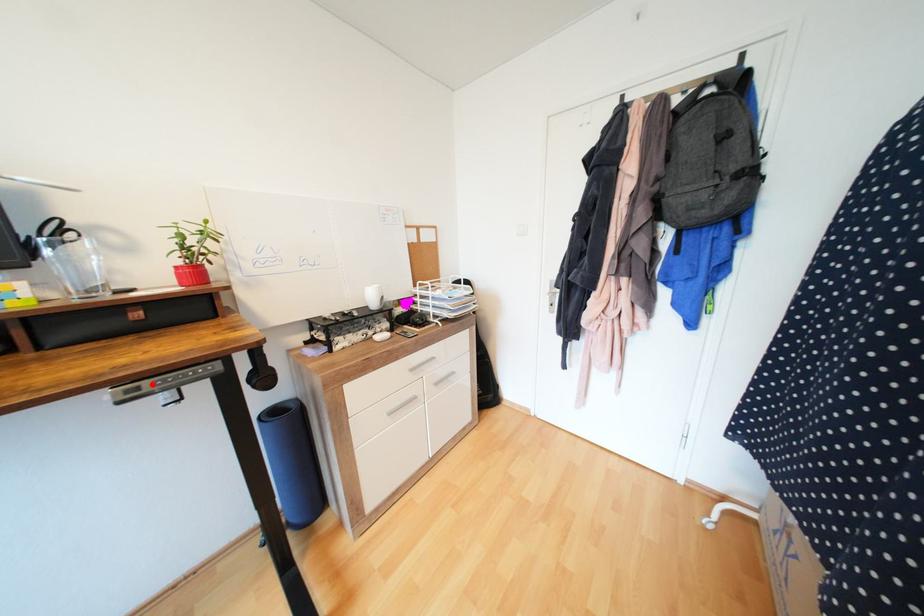
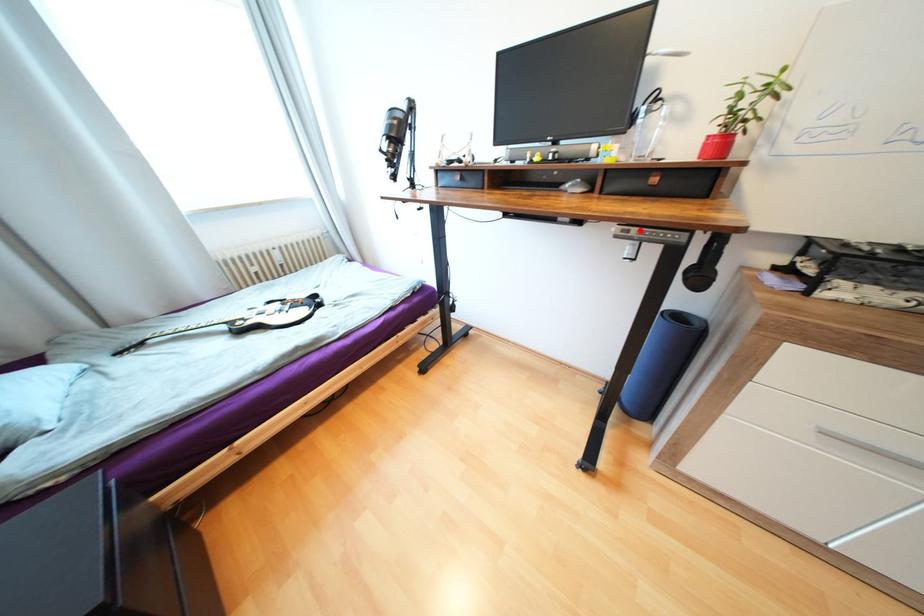
I am providing you with two images of the same scene from different viewpoints. A red point is marked on the first image and another point is marked on the second image. Are the points marked in image1 and image2 representing the same 3D position?

Yes